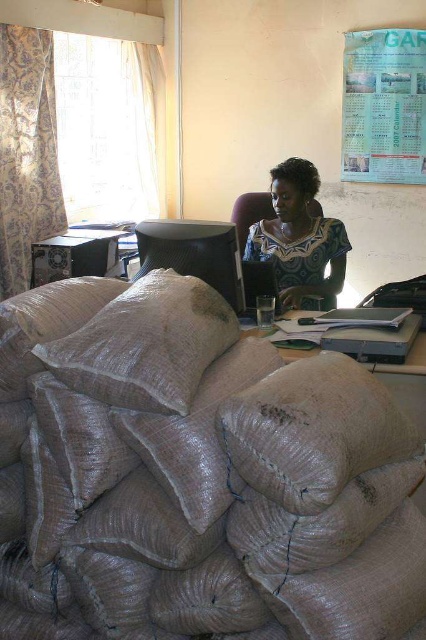
Question: Which point appears farthest from the camera in this image?

Choices:
 (A) (195, 374)
 (B) (419, 353)
 (C) (296, 224)

Answer: (C)

Question: Observing the image, what is the correct spatial positioning of blue printed blouse at center in reference to matte plastic table at center?

Choices:
 (A) right
 (B) left

Answer: (B)

Question: Considering the real-world distances, which object is farthest from the burlap sack at lower center?

Choices:
 (A) matte plastic table at center
 (B) paperboard calendar at upper right
 (C) blue printed blouse at center
 (D) worn canvas pillow at lower left

Answer: (B)

Question: Is paperboard calendar at upper right positioned at the back of blue printed blouse at center?

Choices:
 (A) no
 (B) yes

Answer: (B)

Question: Does paperboard calendar at upper right appear over blue printed blouse at center?

Choices:
 (A) no
 (B) yes

Answer: (B)

Question: Which point is closer to the camera?

Choices:
 (A) (385, 45)
 (B) (282, 204)
 (C) (311, 406)
 (D) (288, 353)

Answer: (C)